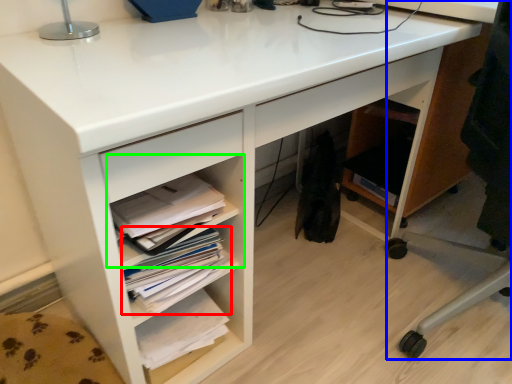
Question: Based on their relative distances, which object is nearer to book (highlighted by a red box)? Choose from computer chair (highlighted by a blue box) and shelf (highlighted by a green box).

Choices:
 (A) computer chair
 (B) shelf

Answer: (B)